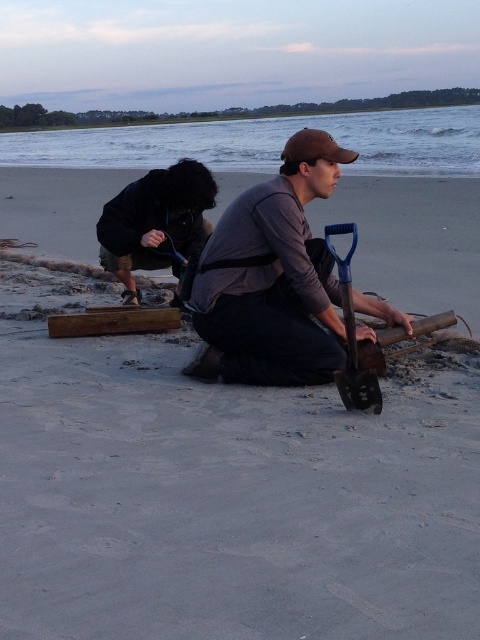
You are a GUI agent. You are given a task and a screenshot of the screen. Output one action in this format:
    pyautogui.click(x=<x>, y=<y>)
    Task: Click on the black fabric bag at left
    
    Given the screenshot: What is the action you would take?
    pyautogui.click(x=156, y=221)

This screenshot has height=640, width=480. Describe the element at coordinates (156, 221) in the screenshot. I see `black fabric bag at left` at that location.

Who is more forward, [182,161] or [156,323]?

Point [182,161] is more forward.

This screenshot has height=640, width=480. What are the coordinates of `black fabric bag at left` in the screenshot? It's located at (156, 221).

Find the location of a particular element. blue plastic shovel at center is located at coordinates (351, 337).

Does blue plastic shovel at center appear on the right side of brown wood at lower center?

Indeed, blue plastic shovel at center is positioned on the right side of brown wood at lower center.

Is point (350, 276) in front of point (88, 332)?

That is True.

Where is `blue plastic shovel at center`? The height and width of the screenshot is (640, 480). blue plastic shovel at center is located at coordinates (351, 337).

Between black fabric bag at left and blue plastic shovel at center, which one appears on the left side from the viewer's perspective?

black fabric bag at left

Between black fabric bag at left and blue plastic shovel at center, which one appears on the right side from the viewer's perspective?

blue plastic shovel at center

Is point (160, 257) positioned in front of point (342, 285)?

No, (160, 257) is behind (342, 285).

I want to click on black fabric bag at left, so [x=156, y=221].